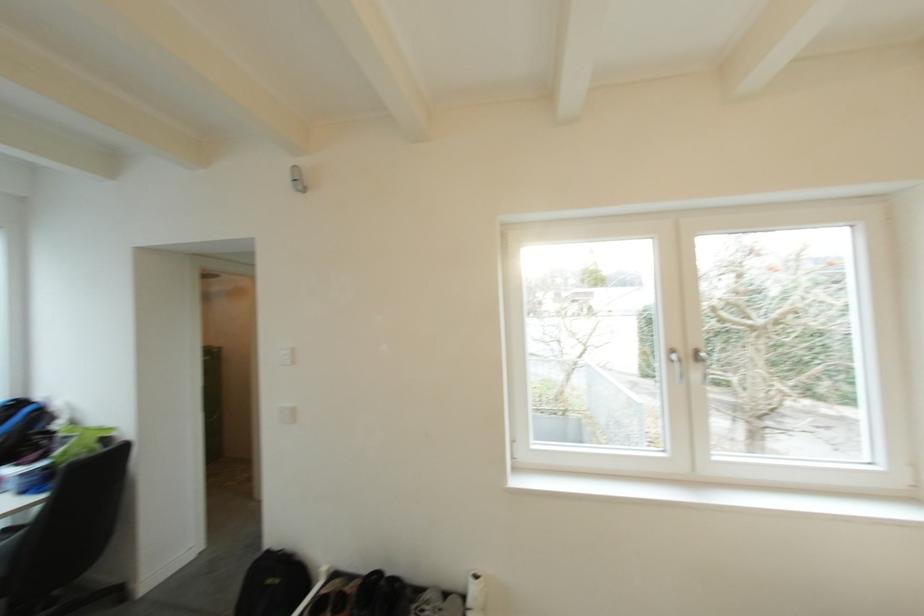
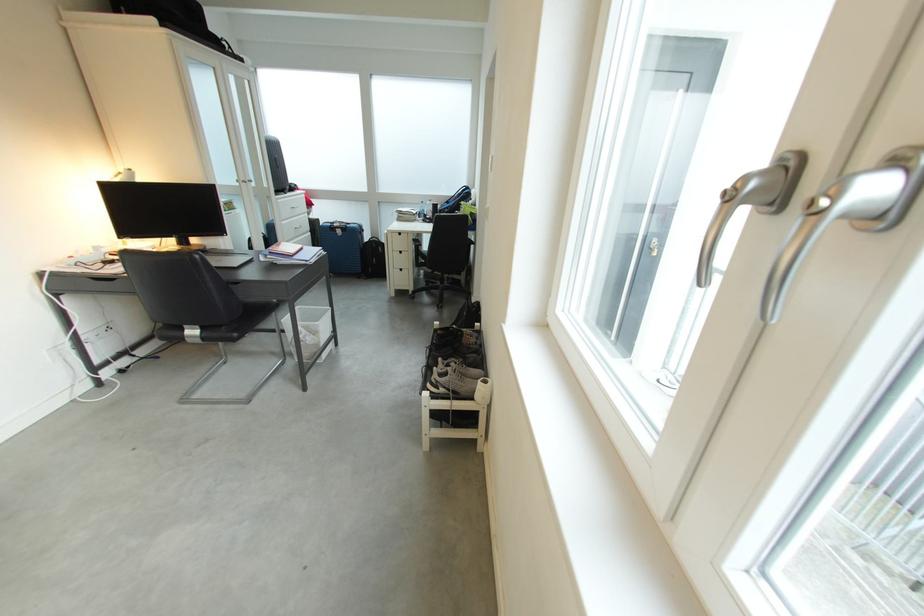
Question: I am providing you with two images of the same scene from different viewpoints. Please identify which objects are invisible in image2.

Choices:
 (A) blue suitcase
 (B) glass dome handle
 (C) silver window handle
 (D) blue and black backpack

Answer: (D)